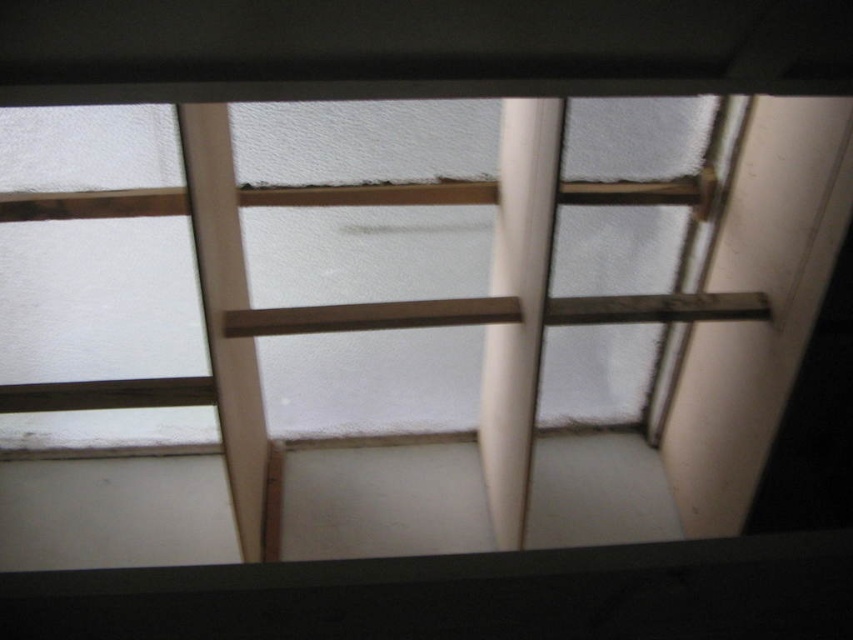
Can you confirm if wooden at upper center is positioned to the left of white smooth pole at center?

Indeed, wooden at upper center is positioned on the left side of white smooth pole at center.

Locate an element on the screen. This screenshot has height=640, width=853. wooden at upper center is located at coordinates (393, 337).